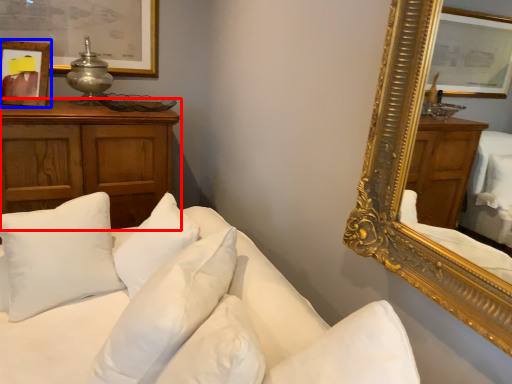
Question: Which of the following is the farthest to the observer, cabinetry (highlighted by a red box) or picture frame (highlighted by a blue box)?

Choices:
 (A) cabinetry
 (B) picture frame

Answer: (B)